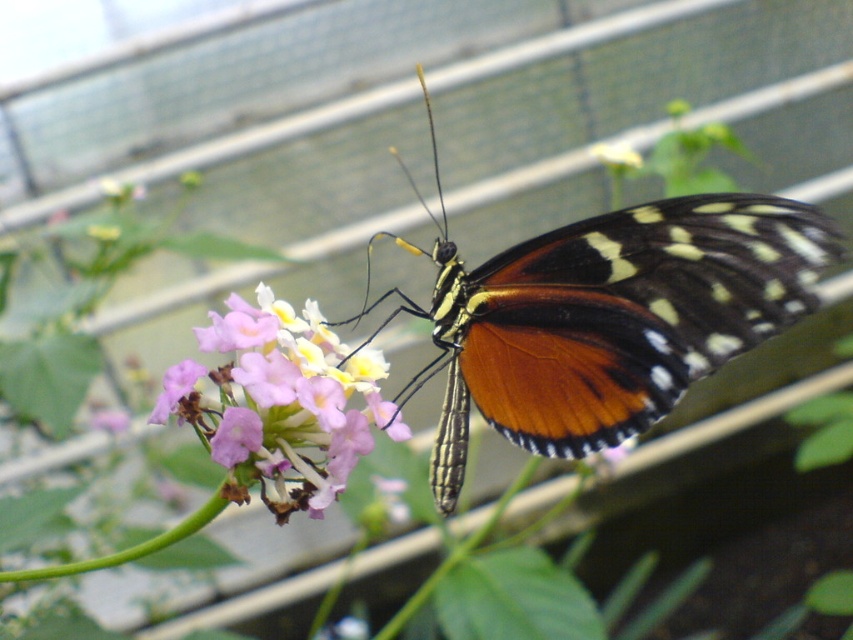
Is orange iridescent wings at center to the right of pink matte flower at center from the viewer's perspective?

Yes, orange iridescent wings at center is to the right of pink matte flower at center.

Does orange iridescent wings at center appear over pink matte flower at center?

Indeed, orange iridescent wings at center is positioned over pink matte flower at center.

Is point (540, 371) positioned before point (229, 474)?

No, (540, 371) is behind (229, 474).

Identify the location of orange iridescent wings at center. The width and height of the screenshot is (853, 640). (604, 316).